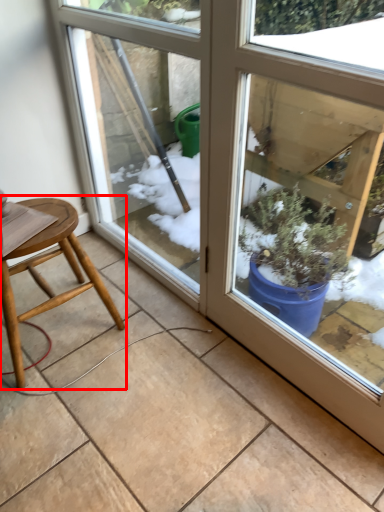
Question: Observing the image, what is the correct spatial positioning of stool (annotated by the red box) in reference to screen door?

Choices:
 (A) right
 (B) left

Answer: (B)